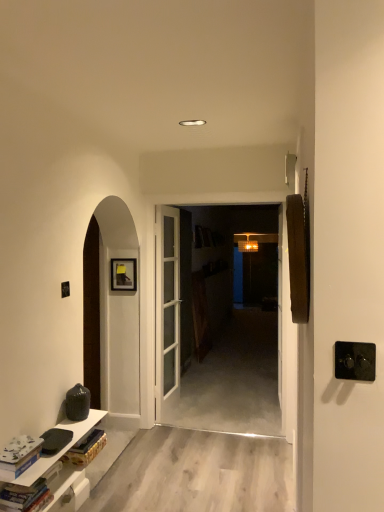
What do you see at coordinates (355, 361) in the screenshot? I see `black plastic door handle at right` at bounding box center [355, 361].

Locate an element on the screen. The image size is (384, 512). white glossy cabinet at lower left is located at coordinates (59, 451).

Identify the location of hardcover book at lower left, which is the 2th book from top to bottom. (25, 497).

From a real-world perspective, who is located higher, white glossy cabinet at lower left or black plastic door handle at right?

In real-world perspective, black plastic door handle at right is above.

Which object is wider, white glossy cabinet at lower left or black plastic door handle at right?

white glossy cabinet at lower left.

In the image, is white glossy cabinet at lower left positioned in front of or behind black plastic door handle at right?

Clearly, white glossy cabinet at lower left is behind black plastic door handle at right.

I want to click on door handle above the white glossy cabinet at lower left (from the image's perspective), so click(355, 361).

Who is bigger, white matte book at lower left, the 2th book from the bottom, or white glossy cabinet at lower left?

white glossy cabinet at lower left.

Does white matte book at lower left, which appears as the first book when viewed from the top, have a lesser width compared to white glossy cabinet at lower left?

Yes, white matte book at lower left, which appears as the first book when viewed from the top, is thinner than white glossy cabinet at lower left.

How many degrees apart are the facing directions of white matte book at lower left, which appears as the first book when viewed from the top, and white glossy cabinet at lower left?

white matte book at lower left, which appears as the first book when viewed from the top, and white glossy cabinet at lower left are facing 0.274 degrees away from each other.

From the image's perspective, is white matte book at lower left, the 2th book from the bottom, beneath white glossy cabinet at lower left?

Actually, white matte book at lower left, the 2th book from the bottom, appears above white glossy cabinet at lower left in the image.

Does point (347, 377) come closer to viewer compared to point (12, 507)?

That is True.

Is black plastic door handle at right in front of or behind hardcover book at lower left, which is the 2th book from top to bottom, in the image?

In the image, black plastic door handle at right appears in front of hardcover book at lower left, which is the 2th book from top to bottom.

How many degrees apart are the facing directions of black plastic door handle at right and hardcover book at lower left, which is the 2th book from top to bottom?

90.1 degrees separate the facing orientations of black plastic door handle at right and hardcover book at lower left, which is the 2th book from top to bottom.

Does black plastic door handle at right have a greater height compared to hardcover book at lower left, which is the 2th book from top to bottom?

Yes, black plastic door handle at right is taller than hardcover book at lower left, which is the 2th book from top to bottom.

Does point (13, 460) come farther from viewer compared to point (342, 353)?

That is True.

Does white matte book at lower left, the 2th book from the bottom, have a lesser height compared to black plastic door handle at right?

No.

Is white matte book at lower left, which appears as the first book when viewed from the top, far from black plastic door handle at right?

white matte book at lower left, which appears as the first book when viewed from the top, is far away from black plastic door handle at right.

Is white glossy cabinet at lower left inside the boundaries of hardcover book at lower left, which is the 2th book from top to bottom, or outside?

white glossy cabinet at lower left is spatially situated outside hardcover book at lower left, which is the 2th book from top to bottom.

In terms of size, does white glossy cabinet at lower left appear bigger or smaller than hardcover book at lower left, which is counted as the first book, starting from the bottom?

In the image, white glossy cabinet at lower left appears to be larger than hardcover book at lower left, which is counted as the first book, starting from the bottom.

From a real-world perspective, which is physically above, white glossy cabinet at lower left or hardcover book at lower left, which is the 2th book from top to bottom?

hardcover book at lower left, which is the 2th book from top to bottom, is physically above.

From the image's perspective, which one is positioned higher, white glossy cabinet at lower left or hardcover book at lower left, which is counted as the first book, starting from the bottom?

hardcover book at lower left, which is counted as the first book, starting from the bottom.

Does black plastic door handle at right have a lesser width compared to white matte book at lower left, which appears as the first book when viewed from the top?

Yes.

Is black plastic door handle at right in contact with white matte book at lower left, which appears as the first book when viewed from the top?

black plastic door handle at right and white matte book at lower left, which appears as the first book when viewed from the top, are clearly separated.

How much distance is there between black plastic door handle at right and white matte book at lower left, which appears as the first book when viewed from the top?

A distance of 1.57 meters exists between black plastic door handle at right and white matte book at lower left, which appears as the first book when viewed from the top.

In the image, is black plastic door handle at right positioned in front of or behind white matte book at lower left, the 2th book from the bottom?

black plastic door handle at right is in front of white matte book at lower left, the 2th book from the bottom.

From the picture: Considering their positions, is hardcover book at lower left, which is counted as the first book, starting from the bottom, located in front of or behind white glossy cabinet at lower left?

hardcover book at lower left, which is counted as the first book, starting from the bottom, is in front of white glossy cabinet at lower left.

Is hardcover book at lower left, which is counted as the first book, starting from the bottom, smaller than white glossy cabinet at lower left?

Indeed, hardcover book at lower left, which is counted as the first book, starting from the bottom, has a smaller size compared to white glossy cabinet at lower left.

Is hardcover book at lower left, which is the 2th book from top to bottom, positioned with its back to white glossy cabinet at lower left?

hardcover book at lower left, which is the 2th book from top to bottom, is not turned away from white glossy cabinet at lower left.

Is hardcover book at lower left, which is counted as the first book, starting from the bottom, taller than white glossy cabinet at lower left?

Yes, hardcover book at lower left, which is counted as the first book, starting from the bottom, is taller than white glossy cabinet at lower left.

Find the location of a particular element. The height and width of the screenshot is (512, 384). cabinetry below the black plastic door handle at right (from the image's perspective) is located at coordinates coord(59,451).

Locate an element on the screen. book that is the 2nd object located above the white glossy cabinet at lower left (from the image's perspective) is located at coordinates (19, 456).

Based on the photo, considering their positions, is white glossy cabinet at lower left positioned further to white matte book at lower left, the 2th book from the bottom, than hardcover book at lower left, which is the 2th book from top to bottom?

Based on the image, white glossy cabinet at lower left appears to be further to white matte book at lower left, the 2th book from the bottom.

Looking at the image, which one is located further to white glossy cabinet at lower left, hardcover book at lower left, which is the 2th book from top to bottom, or white matte book at lower left, the 2th book from the bottom?

hardcover book at lower left, which is the 2th book from top to bottom, lies further to white glossy cabinet at lower left than the other object.

Based on their spatial positions, is hardcover book at lower left, which is counted as the first book, starting from the bottom, or white glossy cabinet at lower left further from white matte book at lower left, which appears as the first book when viewed from the top?

Based on the image, white glossy cabinet at lower left appears to be further to white matte book at lower left, which appears as the first book when viewed from the top.

Which object lies further to the anchor point hardcover book at lower left, which is the 2th book from top to bottom, white matte book at lower left, which appears as the first book when viewed from the top, or white glossy cabinet at lower left?

white glossy cabinet at lower left.

Based on the photo, when comparing their distances from hardcover book at lower left, which is the 2th book from top to bottom, does white glossy cabinet at lower left or black plastic door handle at right seem further?

Based on the image, black plastic door handle at right appears to be further to hardcover book at lower left, which is the 2th book from top to bottom.

From the image, which object appears to be farther from white matte book at lower left, which appears as the first book when viewed from the top, black plastic door handle at right or white glossy cabinet at lower left?

Based on the image, black plastic door handle at right appears to be further to white matte book at lower left, which appears as the first book when viewed from the top.

From the image, which object appears to be farther from hardcover book at lower left, which is counted as the first book, starting from the bottom, black plastic door handle at right or white glossy cabinet at lower left?

black plastic door handle at right is positioned further to the anchor hardcover book at lower left, which is counted as the first book, starting from the bottom.

Looking at the image, which one is located closer to hardcover book at lower left, which is counted as the first book, starting from the bottom, white glossy cabinet at lower left or white matte book at lower left, the 2th book from the bottom?

Based on the image, white matte book at lower left, the 2th book from the bottom, appears to be nearer to hardcover book at lower left, which is counted as the first book, starting from the bottom.

Where is `book between white matte book at lower left, the 2th book from the bottom, and black plastic door handle at right`? The image size is (384, 512). book between white matte book at lower left, the 2th book from the bottom, and black plastic door handle at right is located at coordinates (25, 497).

Where is `cabinetry situated between hardcover book at lower left, which is the 2th book from top to bottom, and black plastic door handle at right from left to right`? The image size is (384, 512). cabinetry situated between hardcover book at lower left, which is the 2th book from top to bottom, and black plastic door handle at right from left to right is located at coordinates (59, 451).

I want to click on cabinetry located between white matte book at lower left, the 2th book from the bottom, and black plastic door handle at right in the left-right direction, so click(x=59, y=451).

Image resolution: width=384 pixels, height=512 pixels. Identify the location of book between white matte book at lower left, which appears as the first book when viewed from the top, and white glossy cabinet at lower left, in the vertical direction. (25, 497).